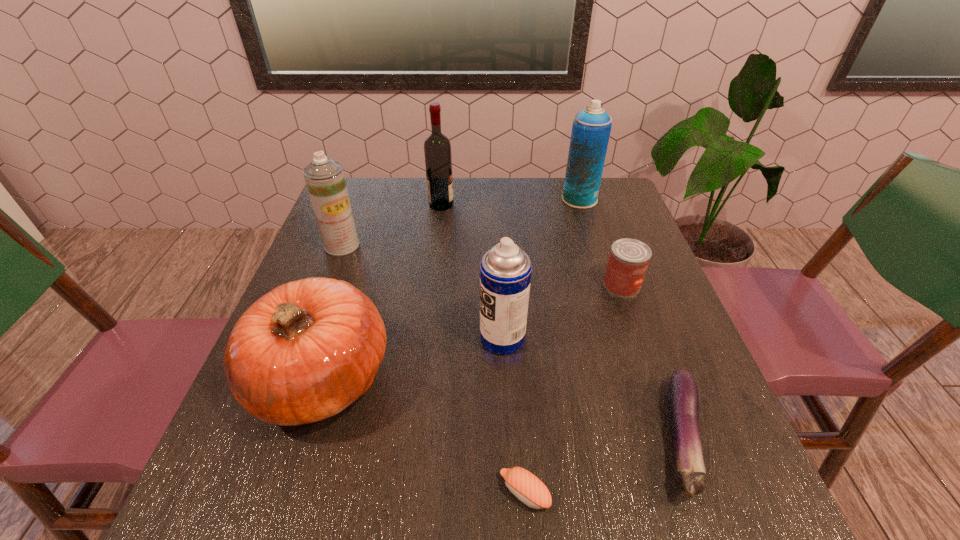
The height and width of the screenshot is (540, 960). I want to click on the third object from left to right, so click(437, 149).

At what (x,y) coordinates should I click in order to perform the action: click on the farthest aerosol can. Please return your answer as a coordinate pair (x, y). This screenshot has height=540, width=960. Looking at the image, I should click on (591, 128).

The width and height of the screenshot is (960, 540). I want to click on the leftmost aerosol can, so click(324, 177).

Where is `the second farthest aerosol can`? the second farthest aerosol can is located at coordinates (324, 177).

This screenshot has height=540, width=960. What are the coordinates of `the nearest aerosol can` in the screenshot? It's located at (505, 271).

Where is `pumpkin`? pumpkin is located at coordinates (305, 351).

Locate an element on the screen. This screenshot has height=540, width=960. the fifth nearest object is located at coordinates (628, 261).

At what (x,y) coordinates should I click in order to perform the action: click on can. Please return your answer as a coordinate pair (x, y). Looking at the image, I should click on (628, 261).

Where is `eggplant`? eggplant is located at coordinates (683, 404).

Image resolution: width=960 pixels, height=540 pixels. Identify the location of the shortest object. (529, 489).